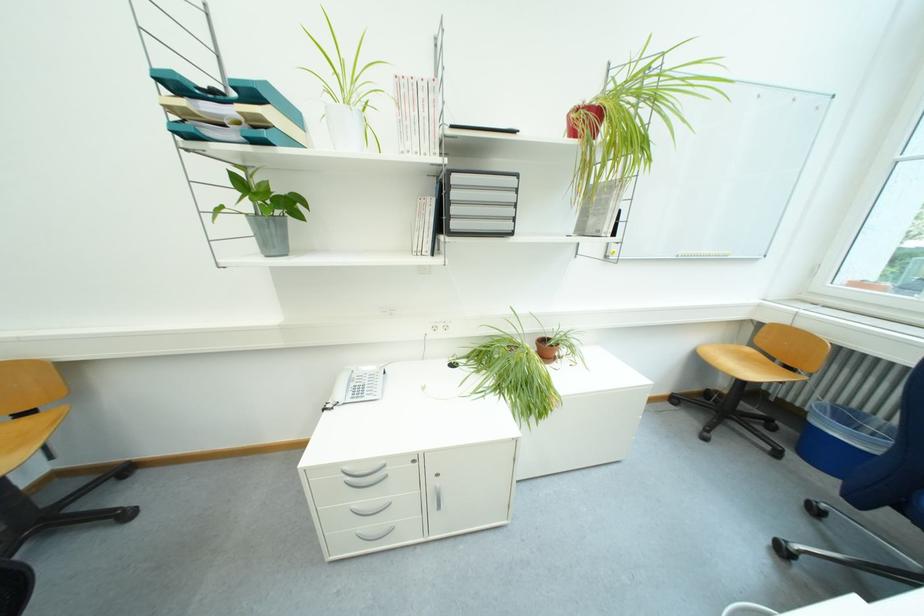
I want to click on small drawer handle, so click(362, 471).